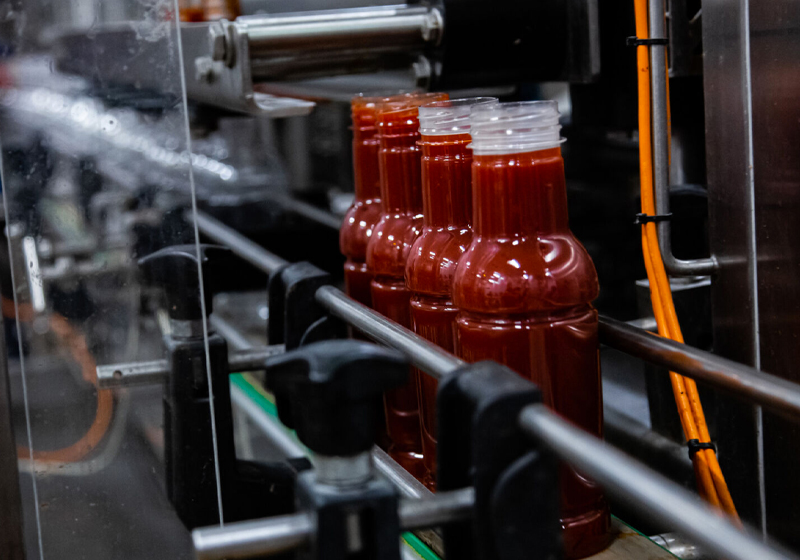
Locate an element on the screen. bottle is located at coordinates (537, 248).